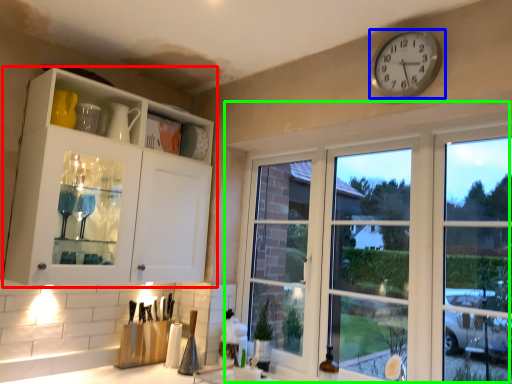
Question: Based on their relative distances, which object is nearer to cabinetry (highlighted by a red box)? Choose from wall clock (highlighted by a blue box) and window (highlighted by a green box).

Choices:
 (A) wall clock
 (B) window

Answer: (B)